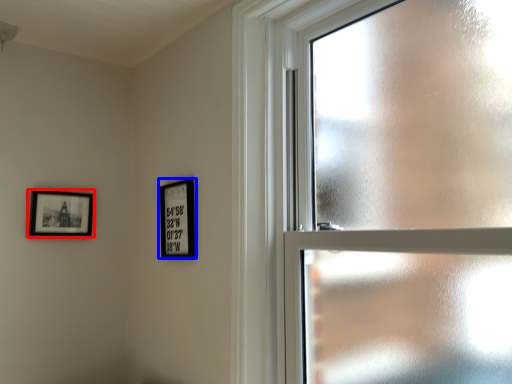
Question: Which object appears farthest to the camera in this image, picture frame (highlighted by a red box) or picture frame (highlighted by a blue box)?

Choices:
 (A) picture frame
 (B) picture frame

Answer: (A)